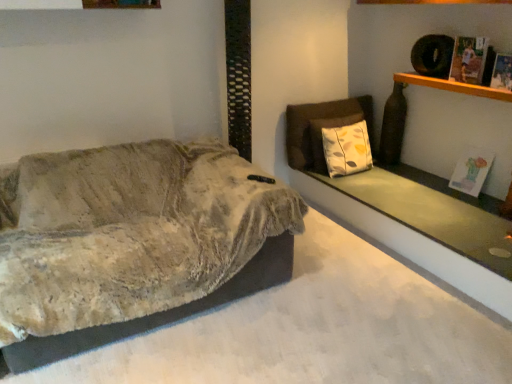
You are a GUI agent. You are given a task and a screenshot of the screen. Output one action in this format:
    pyautogui.click(x=<x>, y=<y>)
    Task: Click on the smooth concrete ledge at upper right
    The image size is (512, 384).
    Given the screenshot: What is the action you would take?
    pyautogui.click(x=431, y=211)

At what (x,y) coordinates should I click in order to perform the action: click on printed paper magazine at upper right, which ranks as the 1th magazine in top-to-bottom order. Please return your answer as a coordinate pair (x, y). The height and width of the screenshot is (384, 512). Looking at the image, I should click on (468, 59).

I want to click on wooden shelf at upper right, so click(x=453, y=86).

Image resolution: width=512 pixels, height=384 pixels. I want to click on smooth concrete ledge at upper right, so click(431, 211).

From the picture: Can you tell me how much matte paper magazine at upper right, the 1th magazine viewed from the back, and textured beige blanket at left differ in facing direction?

They differ by 85.7 degrees in their facing directions.

From a real-world perspective, is matte paper magazine at upper right, arranged as the third magazine when viewed from the top, above or below textured beige blanket at left?

matte paper magazine at upper right, arranged as the third magazine when viewed from the top, is situated higher than textured beige blanket at left in the real world.

From the image's perspective, who appears lower, matte paper magazine at upper right, the 1th magazine viewed from the back, or textured beige blanket at left?

textured beige blanket at left appears lower in the image.

Considering the sizes of objects printed paper magazine at upper right, arranged as the 2th magazine when viewed from the front, and smooth concrete ledge at upper right in the image provided, who is shorter, printed paper magazine at upper right, arranged as the 2th magazine when viewed from the front, or smooth concrete ledge at upper right?

smooth concrete ledge at upper right.

This screenshot has height=384, width=512. I want to click on ledge lying in front of the printed paper magazine at upper right, arranged as the second magazine when viewed from the back, so click(x=431, y=211).

In the image, is printed paper magazine at upper right, which ranks as the 1th magazine in top-to-bottom order, positioned in front of or behind smooth concrete ledge at upper right?

In the image, printed paper magazine at upper right, which ranks as the 1th magazine in top-to-bottom order, appears behind smooth concrete ledge at upper right.

In the scene shown: Is printed paper magazine at upper right, which ranks as the 1th magazine in top-to-bottom order, facing away from smooth concrete ledge at upper right?

No, printed paper magazine at upper right, which ranks as the 1th magazine in top-to-bottom order, is not facing the opposite direction of smooth concrete ledge at upper right.

Can you tell me how much smooth concrete ledge at upper right and matte paper magazine at upper right, the 1th magazine viewed from the back, differ in facing direction?

The facing directions of smooth concrete ledge at upper right and matte paper magazine at upper right, the 1th magazine viewed from the back, are 4.27 degrees apart.

Is smooth concrete ledge at upper right aimed at matte paper magazine at upper right, the 1th magazine from the bottom?

No.

You are a GUI agent. You are given a task and a screenshot of the screen. Output one action in this format:
    pyautogui.click(x=<x>, y=<y>)
    Task: Click on the 1st magazine located above the smooth concrete ledge at upper right (from a real-world perspective)
    The image size is (512, 384).
    Given the screenshot: What is the action you would take?
    pyautogui.click(x=471, y=171)

Would you say smooth concrete ledge at upper right is outside matte paper magazine at upper right, arranged as the third magazine when viewed from the top?

Yes.

Is point (465, 169) closer or farther from the camera than point (475, 81)?

Point (465, 169) appears to be farther away from the viewer than point (475, 81).

Are matte paper magazine at upper right, acting as the third magazine starting from the front, and printed paper magazine at upper right, which ranks as the 1th magazine in top-to-bottom order, beside each other?

No, matte paper magazine at upper right, acting as the third magazine starting from the front, is not touching printed paper magazine at upper right, which ranks as the 1th magazine in top-to-bottom order.

Identify the location of the 2nd magazine positioned below the printed paper magazine at upper right, arranged as the 2th magazine when viewed from the front (from a real-world perspective). The height and width of the screenshot is (384, 512). (471, 171).

Is printed paper magazine at upper right, placed as the 3th magazine when sorted from bottom to top, at the back of matte paper magazine at upper right, arranged as the third magazine when viewed from the top?

No, printed paper magazine at upper right, placed as the 3th magazine when sorted from bottom to top, is not at the back of matte paper magazine at upper right, arranged as the third magazine when viewed from the top.

Is matte paper magazine at upper right, arranged as the third magazine when viewed from the top, oriented towards printed paper magazine at upper right, positioned as the second magazine in top-to-bottom order?

No.

Is the depth of matte paper magazine at upper right, arranged as the third magazine when viewed from the top, greater than that of printed paper magazine at upper right, positioned as the second magazine in top-to-bottom order?

Yes.

Measure the distance between matte paper magazine at upper right, acting as the third magazine starting from the front, and printed paper magazine at upper right, positioned as the second magazine in top-to-bottom order.

matte paper magazine at upper right, acting as the third magazine starting from the front, and printed paper magazine at upper right, positioned as the second magazine in top-to-bottom order, are 26.00 inches apart.

Is matte paper magazine at upper right, acting as the third magazine starting from the front, completely or partially outside of printed paper magazine at upper right, the 1th magazine from the front?

Yes, matte paper magazine at upper right, acting as the third magazine starting from the front, is not within printed paper magazine at upper right, the 1th magazine from the front.

Is wooden shelf at upper right outside of printed paper magazine at upper right, which is the third magazine in back-to-front order?

wooden shelf at upper right lies outside printed paper magazine at upper right, which is the third magazine in back-to-front order,'s area.

Could you tell me if wooden shelf at upper right is facing printed paper magazine at upper right, the 1th magazine from the front?

No, wooden shelf at upper right does not turn towards printed paper magazine at upper right, the 1th magazine from the front.

From a real-world perspective, who is located lower, wooden shelf at upper right or printed paper magazine at upper right, which is the third magazine in back-to-front order?

In real-world perspective, wooden shelf at upper right is lower.

Which is behind, wooden shelf at upper right or printed paper magazine at upper right, the 1th magazine from the front?

Positioned behind is wooden shelf at upper right.

From the image's perspective, is textured beige blanket at left below matte paper magazine at upper right, the 1th magazine viewed from the back?

Indeed, from the image's perspective, textured beige blanket at left is shown beneath matte paper magazine at upper right, the 1th magazine viewed from the back.

Based on the photo, from a real-world perspective, is textured beige blanket at left physically located above or below matte paper magazine at upper right, the 1th magazine from the bottom?

textured beige blanket at left is situated lower than matte paper magazine at upper right, the 1th magazine from the bottom, in the real world.

Can you confirm if textured beige blanket at left is wider than matte paper magazine at upper right, the 1th magazine from the bottom?

Correct, the width of textured beige blanket at left exceeds that of matte paper magazine at upper right, the 1th magazine from the bottom.

You are a GUI agent. You are given a task and a screenshot of the screen. Output one action in this format:
    pyautogui.click(x=<x>, y=<y>)
    Task: Click on the studio couch on the left of matte paper magazine at upper right, the 1th magazine from the bottom
    The height and width of the screenshot is (384, 512).
    Given the screenshot: What is the action you would take?
    pyautogui.click(x=127, y=239)

At what (x,y) coordinates should I click in order to perform the action: click on the 3rd magazine above the smooth concrete ledge at upper right (from a real-world perspective). Please return your answer as a coordinate pair (x, y). Looking at the image, I should click on (468, 59).

When comparing their distances from smooth concrete ledge at upper right, does printed paper magazine at upper right, positioned as the second magazine in top-to-bottom order, or matte paper magazine at upper right, acting as the third magazine starting from the front, seem closer?

matte paper magazine at upper right, acting as the third magazine starting from the front, is positioned closer to the anchor smooth concrete ledge at upper right.

From the image, which object appears to be nearer to textured beige blanket at left, smooth concrete ledge at upper right or wooden shelf at upper right?

smooth concrete ledge at upper right is closer to textured beige blanket at left.

When comparing their distances from printed paper magazine at upper right, the 2th magazine ordered from the bottom, does smooth concrete ledge at upper right or matte paper magazine at upper right, the 1th magazine from the bottom, seem closer?

The object closer to printed paper magazine at upper right, the 2th magazine ordered from the bottom, is matte paper magazine at upper right, the 1th magazine from the bottom.

In the scene shown: Considering their positions, is matte paper magazine at upper right, the 1th magazine viewed from the back, positioned closer to smooth concrete ledge at upper right than wooden shelf at upper right?

Based on the image, matte paper magazine at upper right, the 1th magazine viewed from the back, appears to be nearer to smooth concrete ledge at upper right.

Estimate the real-world distances between objects in this image. Which object is closer to textured beige blanket at left, wooden shelf at upper right or printed paper magazine at upper right, placed as the 3th magazine when sorted from bottom to top?

Among the two, printed paper magazine at upper right, placed as the 3th magazine when sorted from bottom to top, is located nearer to textured beige blanket at left.

Considering their positions, is printed paper magazine at upper right, arranged as the second magazine when viewed from the back, positioned closer to matte paper magazine at upper right, arranged as the third magazine when viewed from the top, than textured beige blanket at left?

printed paper magazine at upper right, arranged as the second magazine when viewed from the back, is closer to matte paper magazine at upper right, arranged as the third magazine when viewed from the top.

Which object lies further to the anchor point printed paper magazine at upper right, which ranks as the 1th magazine in top-to-bottom order, matte paper magazine at upper right, the 1th magazine from the bottom, or printed paper magazine at upper right, the 1th magazine from the front?

The object further to printed paper magazine at upper right, which ranks as the 1th magazine in top-to-bottom order, is matte paper magazine at upper right, the 1th magazine from the bottom.

From the image, which object appears to be nearer to matte paper magazine at upper right, arranged as the third magazine when viewed from the top, smooth concrete ledge at upper right or wooden shelf at upper right?

smooth concrete ledge at upper right is closer to matte paper magazine at upper right, arranged as the third magazine when viewed from the top.

Locate an element on the screen. shelf between textured beige blanket at left and printed paper magazine at upper right, positioned as the second magazine in top-to-bottom order is located at coordinates (453, 86).

The image size is (512, 384). What are the coordinates of `shelf between textured beige blanket at left and printed paper magazine at upper right, placed as the 3th magazine when sorted from bottom to top` in the screenshot? It's located at (453, 86).

Where is `magazine situated between textured beige blanket at left and printed paper magazine at upper right, positioned as the second magazine in top-to-bottom order, from left to right`? This screenshot has height=384, width=512. magazine situated between textured beige blanket at left and printed paper magazine at upper right, positioned as the second magazine in top-to-bottom order, from left to right is located at coordinates (468, 59).

This screenshot has width=512, height=384. Find the location of `shelf between printed paper magazine at upper right, positioned as the second magazine in top-to-bottom order, and smooth concrete ledge at upper right vertically`. shelf between printed paper magazine at upper right, positioned as the second magazine in top-to-bottom order, and smooth concrete ledge at upper right vertically is located at coordinates (453, 86).